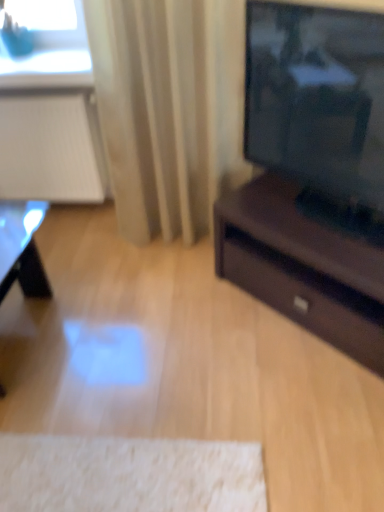
At what (x,y) coordinates should I click in order to perform the action: click on vacant area that lies in front of beige fabric curtain at center. Please return your answer as a coordinate pair (x, y). Looking at the image, I should click on (178, 279).